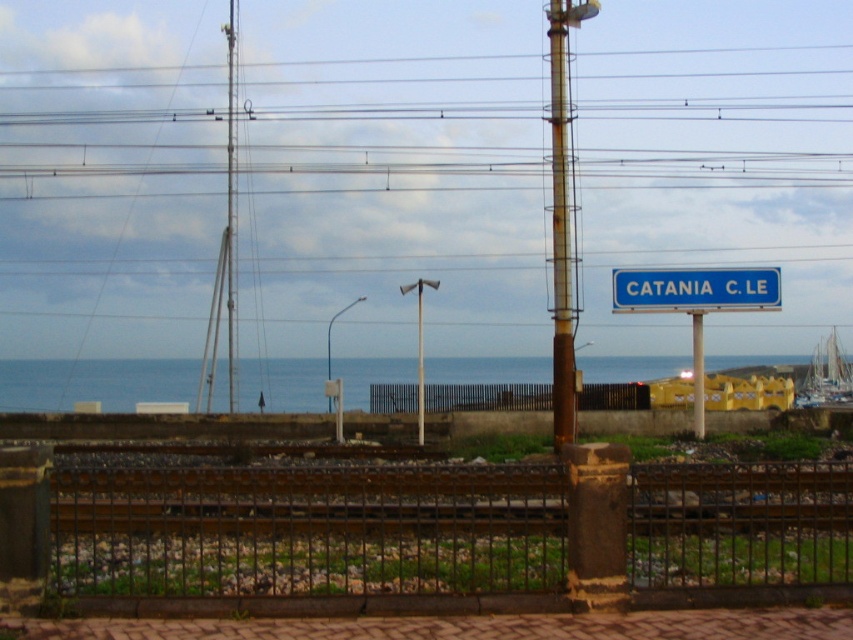
Question: Among these objects, which one is farthest from the camera?

Choices:
 (A) black metal fence at center
 (B) rusty metal pole at center
 (C) metallic pole at upper center

Answer: (C)

Question: Which is farther from the metallic pole at upper center?

Choices:
 (A) blue water at center
 (B) blue plastic sign at upper center

Answer: (A)

Question: Is the position of rusty metal pole at center less distant than that of blue plastic sign at upper center?

Choices:
 (A) yes
 (B) no

Answer: (A)

Question: Which point is farther to the camera?

Choices:
 (A) (250, 388)
 (B) (618, 285)
 (C) (694, 376)
 (D) (194, 502)

Answer: (A)

Question: Is blue plastic sign at upper center in front of black metal fence at center?

Choices:
 (A) no
 (B) yes

Answer: (A)

Question: Can you confirm if blue water at center is wider than blue plastic sign at upper center?

Choices:
 (A) no
 (B) yes

Answer: (B)